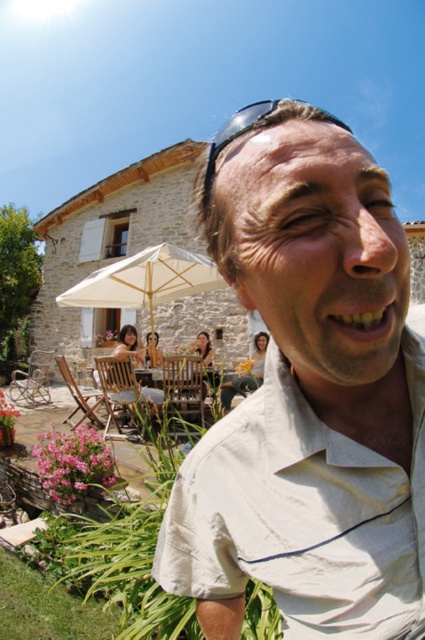
Is beige cotton shirt at center thinner than beige fabric umbrella at center?

Yes, beige cotton shirt at center is thinner than beige fabric umbrella at center.

Consider the image. Which of these two, beige cotton shirt at center or beige fabric umbrella at center, stands taller?

beige fabric umbrella at center is taller.

Describe the element at coordinates (308, 396) in the screenshot. The width and height of the screenshot is (425, 640). I see `beige cotton shirt at center` at that location.

The image size is (425, 640). In order to click on beige cotton shirt at center in this screenshot , I will do `click(308, 396)`.

Is beige fabric umbrella at center taller than sunglasses at upper center?

Incorrect, beige fabric umbrella at center's height is not larger of sunglasses at upper center's.

Is beige fabric umbrella at center to the right of sunglasses at upper center from the viewer's perspective?

In fact, beige fabric umbrella at center is to the left of sunglasses at upper center.

Is point (122, 292) behind point (342, 122)?

Yes, point (122, 292) is behind point (342, 122).

This screenshot has width=425, height=640. I want to click on beige fabric umbrella at center, so click(x=144, y=280).

Which is below, beige cotton shirt at center or sunglasses at upper center?

Positioned lower is beige cotton shirt at center.

Is beige cotton shirt at center to the left of sunglasses at upper center from the viewer's perspective?

Correct, you'll find beige cotton shirt at center to the left of sunglasses at upper center.

Who is more distant from viewer, (x=371, y=433) or (x=337, y=122)?

Point (x=371, y=433)

At what (x,y) coordinates should I click in order to perform the action: click on beige cotton shirt at center. Please return your answer as a coordinate pair (x, y). The image size is (425, 640). Looking at the image, I should click on click(x=308, y=396).